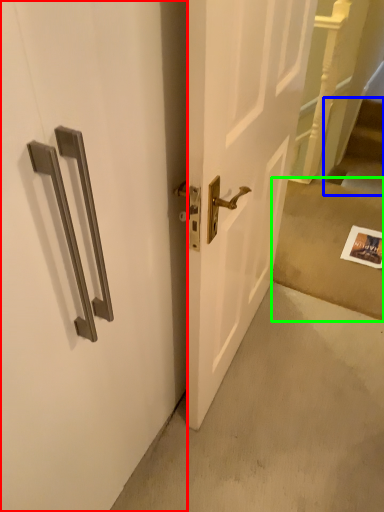
Question: Estimate the real-world distances between objects in this image. Which object is closer to door (highlighted by a red box), stairwell (highlighted by a blue box) or concrete (highlighted by a green box)?

Choices:
 (A) stairwell
 (B) concrete

Answer: (B)